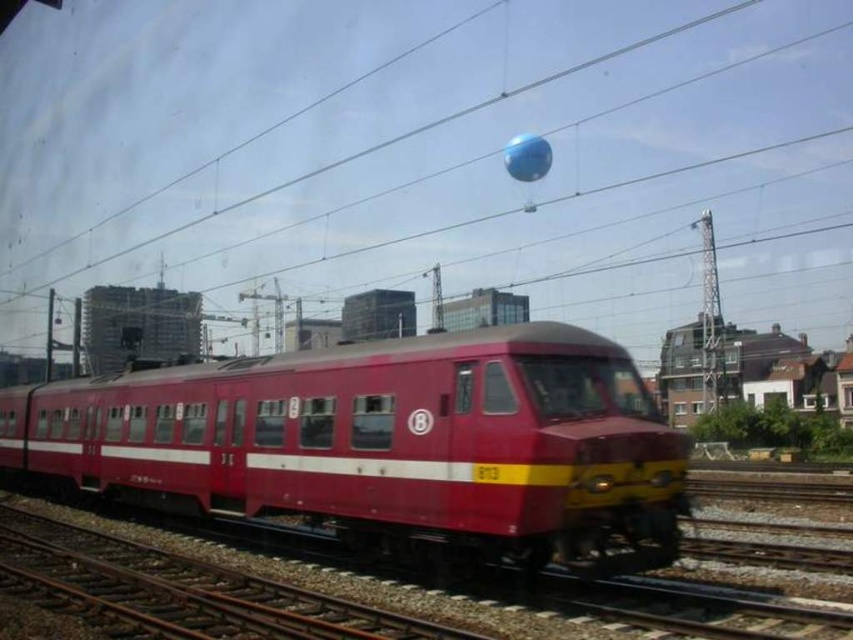
Question: Can you confirm if matte red train at center is wider than blue rubber balloon at upper center?

Choices:
 (A) yes
 (B) no

Answer: (A)

Question: Which object is farther from the camera taking this photo?

Choices:
 (A) matte red train at center
 (B) blue rubber balloon at upper center

Answer: (B)

Question: Does matte red train at center appear on the left side of blue rubber balloon at upper center?

Choices:
 (A) yes
 (B) no

Answer: (A)

Question: Which object appears closest to the camera in this image?

Choices:
 (A) matte red train at center
 (B) blue rubber balloon at upper center

Answer: (A)

Question: Can you confirm if matte red train at center is positioned to the left of blue rubber balloon at upper center?

Choices:
 (A) yes
 (B) no

Answer: (A)